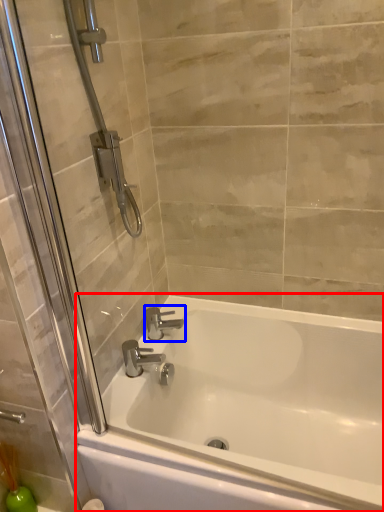
Question: Which object is closer to the camera taking this photo, bathtub (highlighted by a red box) or tap (highlighted by a blue box)?

Choices:
 (A) bathtub
 (B) tap

Answer: (A)